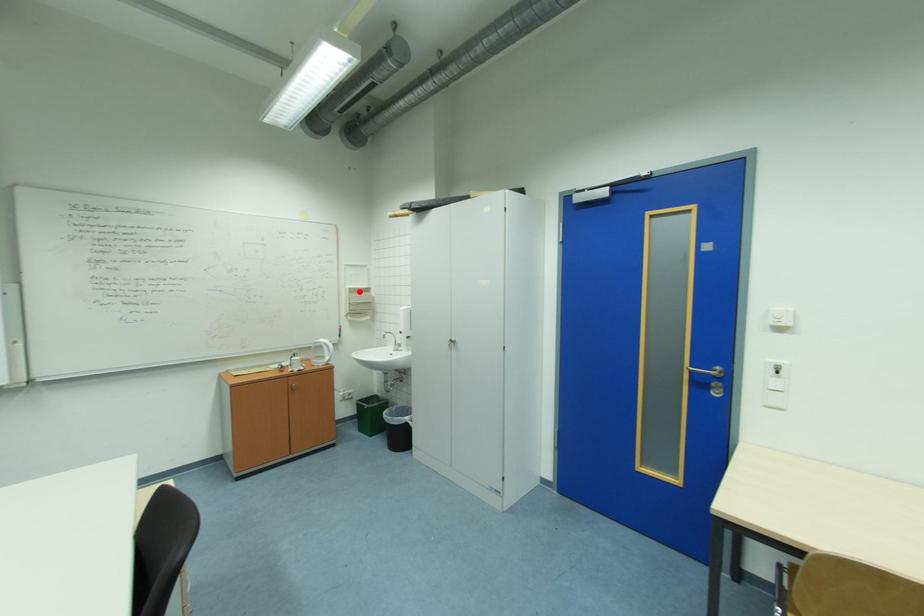
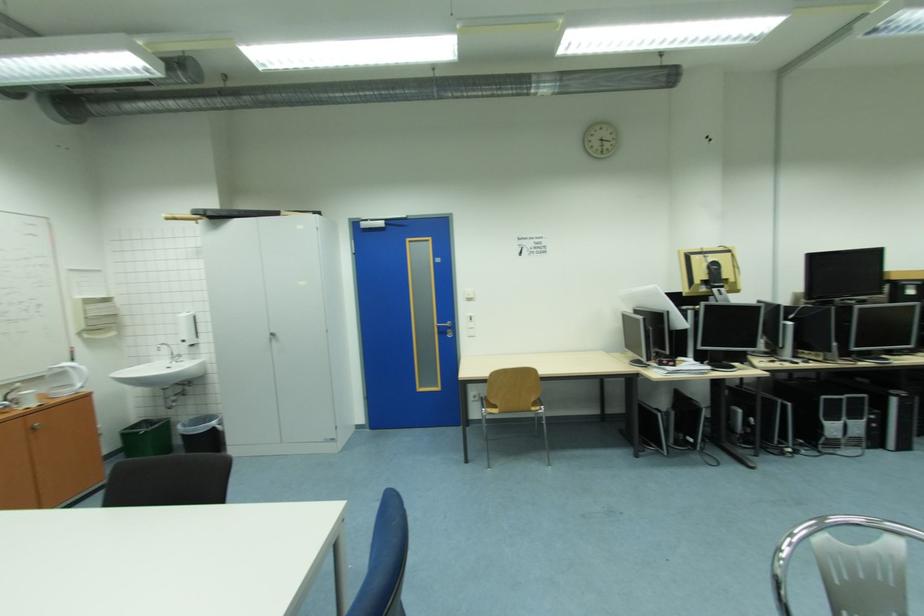
The point at the highlighted location is marked in the first image. Where is the corresponding point in the second image?

(94, 302)